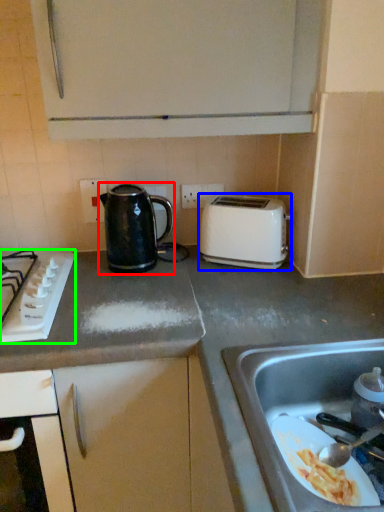
Question: Which object is the closest to the kettle (highlighted by a red box)? Choose among these: toaster (highlighted by a blue box) or gas stove (highlighted by a green box).

Choices:
 (A) toaster
 (B) gas stove

Answer: (B)